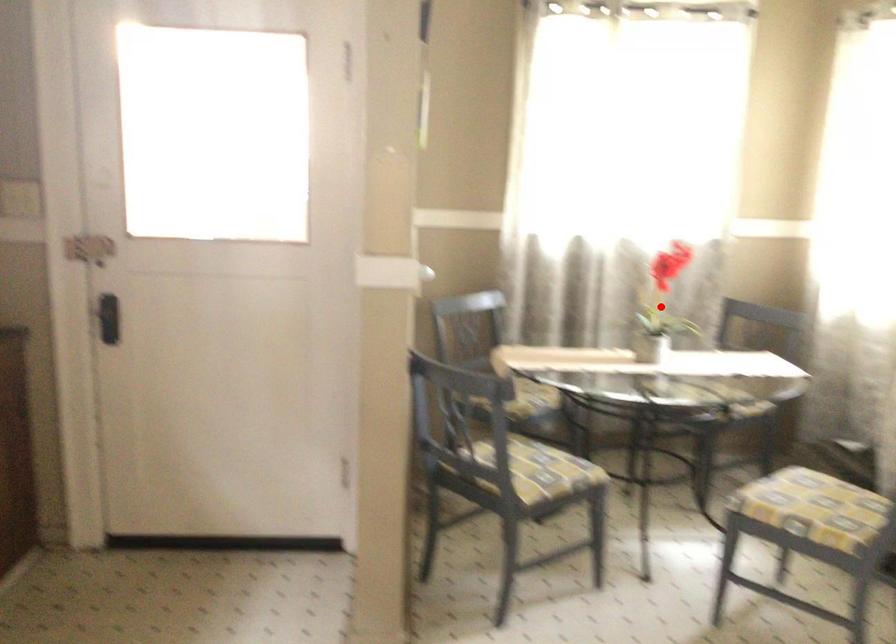
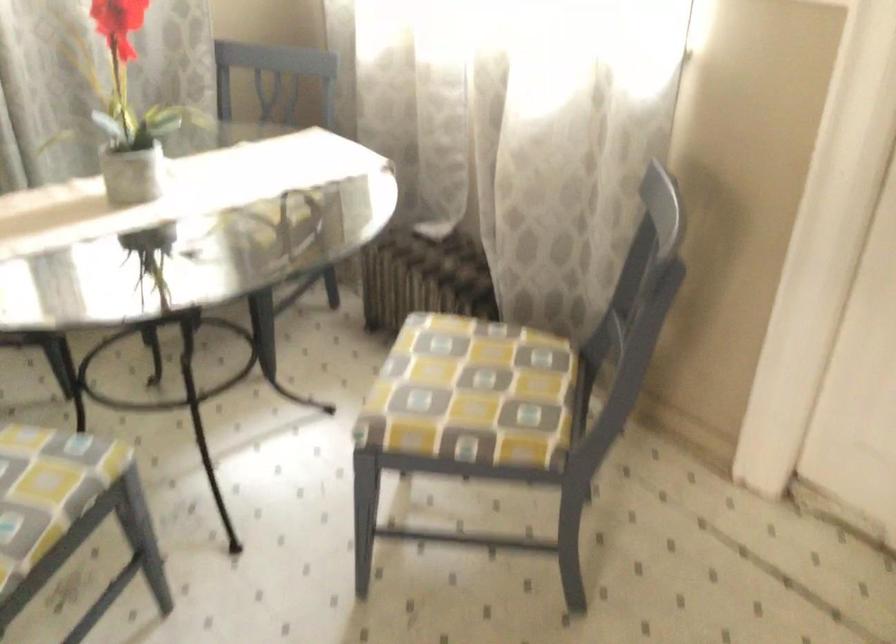
Question: I am providing you with two images of the same scene from different viewpoints. A red point is marked on the first image. Can you still see the location of the red point in image 2?

Choices:
 (A) Yes
 (B) No

Answer: (B)